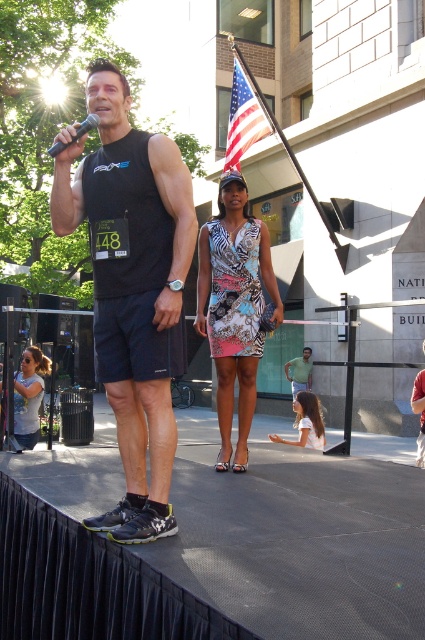
You are attending a public event and see the printed fabric dress at center and the american flag at upper center. Which object is located higher in the image?

The american flag at upper center is higher because it is positioned above the printed fabric dress at center.

You are at an outdoor event and see two people. One is wearing a black matte tank top at center and the other a matte gray tank top at lower left. Which person is positioned to the right of the other?

The black matte tank top at center is positioned to the right of the matte gray tank top at lower left.